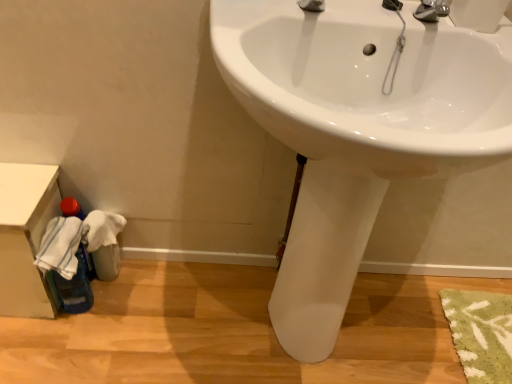
The height and width of the screenshot is (384, 512). I want to click on vacant area situated to the left side of white glossy sink at center, so pos(139,316).